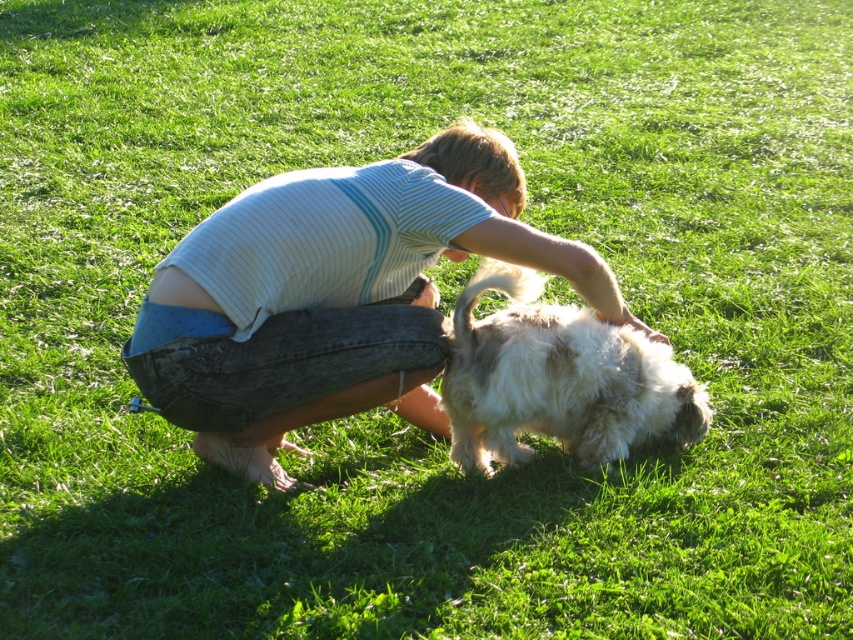
Is light blue striped shirt at center wider than white fluffy dog at center?

Correct, the width of light blue striped shirt at center exceeds that of white fluffy dog at center.

Which is below, light blue striped shirt at center or white fluffy dog at center?

white fluffy dog at center is below.

Image resolution: width=853 pixels, height=640 pixels. I want to click on light blue striped shirt at center, so click(x=335, y=296).